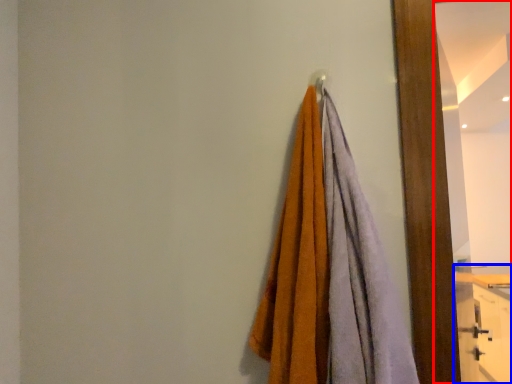
Question: Among these objects, which one is nearest to the camera, mirror (highlighted by a red box) or dresser (highlighted by a blue box)?

Choices:
 (A) mirror
 (B) dresser

Answer: (A)